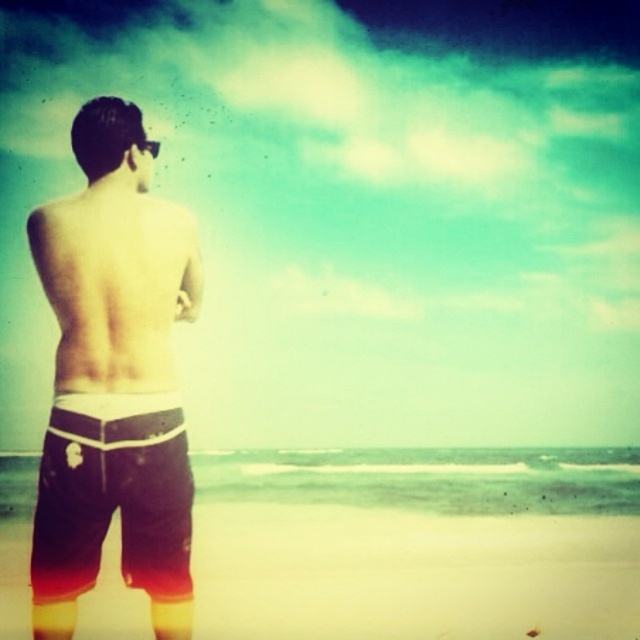
Looking at this image, you are a photographer setting up a shot of the beach scene. You have a wide angle lens that can capture 10 meters horizontally. The dark brown shorts at left and beige sand at lower center are in your frame. Can both fit side by side horizontally if the shorts are narrower than the sand?

The dark brown shorts at left has a lesser width compared to beige sand at lower center. Since the shorts are narrower, both can fit side by side within the 10 meter horizontal capture range of the wide angle lens.

You are a photographer trying to capture the perfect shot of the dark brown shorts at left. Based on the coordinates provided, where should you position your camera relative to the person?

The dark brown shorts at left are located at coordinates point (x=113, y=378). To capture them, position your camera slightly to the left and lower down to align with those coordinates.

You are a photographer trying to capture the perfect shot of the dark brown shorts at left and the beige sand at lower center. If your camera can focus on objects up to 10 meters away, will you be able to get both in focus at the same time?

The dark brown shorts at left and the beige sand at lower center are 9.24 meters apart from each other. Since the maximum focus distance of the camera is 10 meters, both objects are within the focus range, so yes, you can get both in focus at the same time.